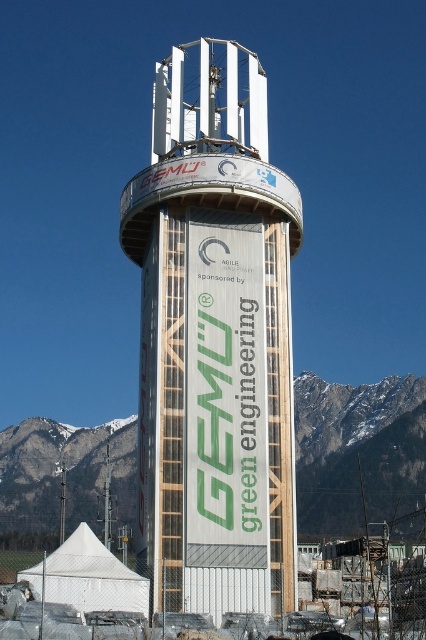
Is wooden tower at center in front of snowy rocky mountain at center?

Yes, wooden tower at center is in front of snowy rocky mountain at center.

The image size is (426, 640). What do you see at coordinates (215, 342) in the screenshot?
I see `wooden tower at center` at bounding box center [215, 342].

Does point (167, 314) come farther from viewer compared to point (414, 424)?

No, (167, 314) is in front of (414, 424).

You are a GUI agent. You are given a task and a screenshot of the screen. Output one action in this format:
    pyautogui.click(x=<x>, y=<y>)
    Task: Click on the wooden tower at center
    
    Given the screenshot: What is the action you would take?
    [215, 342]